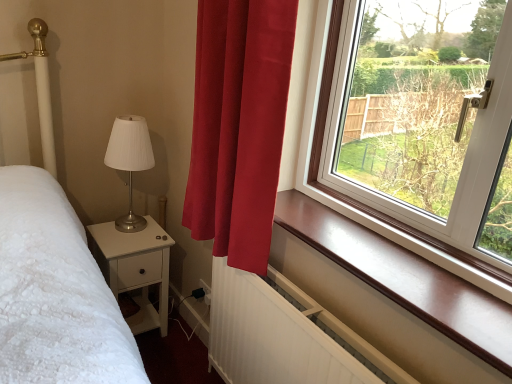
Question: Visually, is matte silver table lamp at left positioned to the left or to the right of brown polished wood at upper right?

Choices:
 (A) left
 (B) right

Answer: (A)

Question: In the image, is matte silver table lamp at left positioned in front of or behind brown polished wood at upper right?

Choices:
 (A) behind
 (B) front

Answer: (A)

Question: Estimate the real-world distances between objects in this image. Which object is closer to the satin red curtain at center?

Choices:
 (A) brown polished wood at upper right
 (B) matte silver table lamp at left
 (C) white matte nightstand at lower left
 (D) white textured radiator at lower center

Answer: (A)

Question: Which is farther from the matte silver table lamp at left?

Choices:
 (A) brown polished wood at upper right
 (B) satin red curtain at center
 (C) white matte nightstand at lower left
 (D) white textured radiator at lower center

Answer: (A)